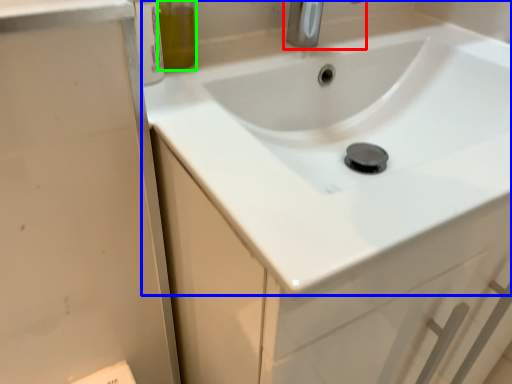
Question: Which object is the farthest from tap (highlighted by a red box)? Choose among these: sink (highlighted by a blue box) or olive oil (highlighted by a green box).

Choices:
 (A) sink
 (B) olive oil

Answer: (A)